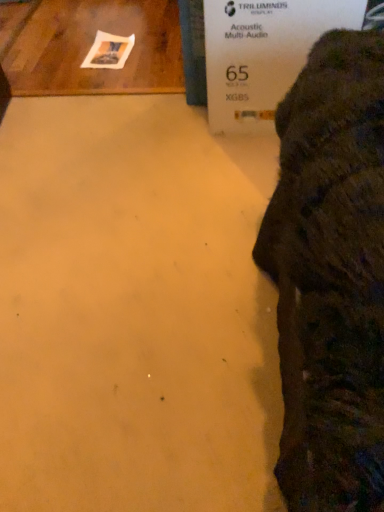
You are a GUI agent. You are given a task and a screenshot of the screen. Output one action in this format:
    pyautogui.click(x=<x>, y=<y>)
    Task: Click on the wooden at upper left
    
    Given the screenshot: What is the action you would take?
    pyautogui.click(x=90, y=47)

The height and width of the screenshot is (512, 384). Describe the element at coordinates (90, 47) in the screenshot. I see `wooden at upper left` at that location.

Where is `wooden at upper left`? This screenshot has height=512, width=384. wooden at upper left is located at coordinates (90, 47).